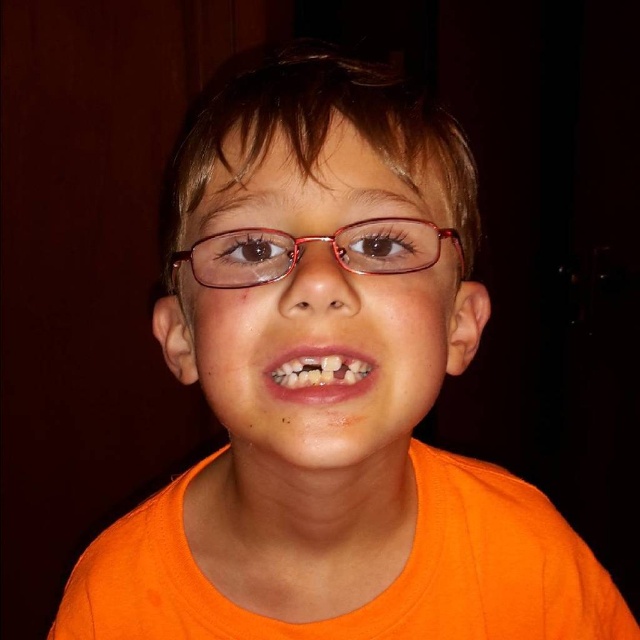
Question: Which point is farther from the camera taking this photo?

Choices:
 (A) (310, 342)
 (B) (355, 269)
 (C) (332, 348)

Answer: (B)

Question: Is matte plastic glasses at center behind matte pink plastic glasses at center?

Choices:
 (A) no
 (B) yes

Answer: (A)

Question: Which point is farther from the camera taking this photo?

Choices:
 (A) (196, 228)
 (B) (426, 224)
 (C) (369, 380)

Answer: (A)

Question: Which is farther from the matte pink plastic glasses at center?

Choices:
 (A) matte plastic glasses at center
 (B) white glossy teeth at center

Answer: (B)

Question: Does matte plastic glasses at center lie in front of matte pink plastic glasses at center?

Choices:
 (A) yes
 (B) no

Answer: (A)

Question: Observing the image, what is the correct spatial positioning of matte pink plastic glasses at center in reference to white glossy teeth at center?

Choices:
 (A) left
 (B) right

Answer: (A)